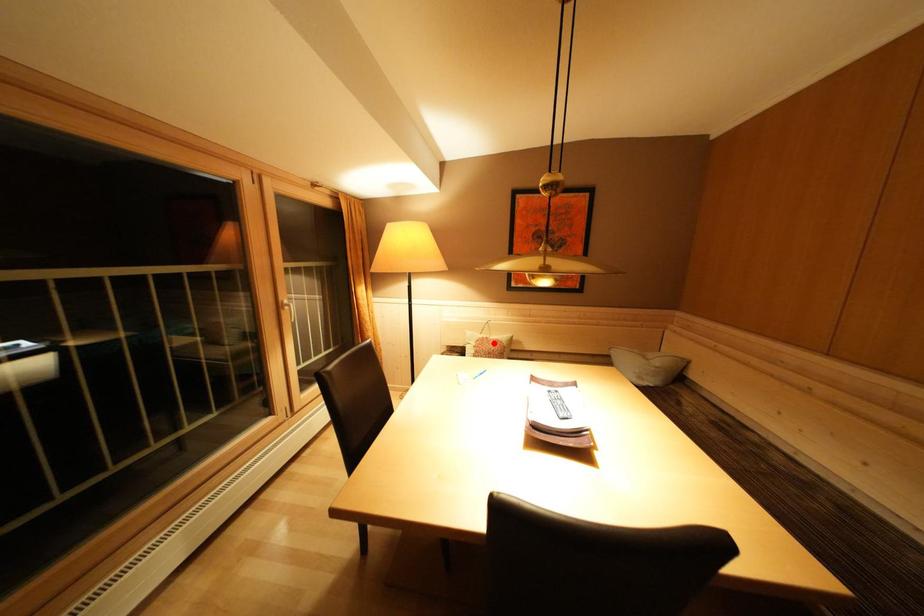
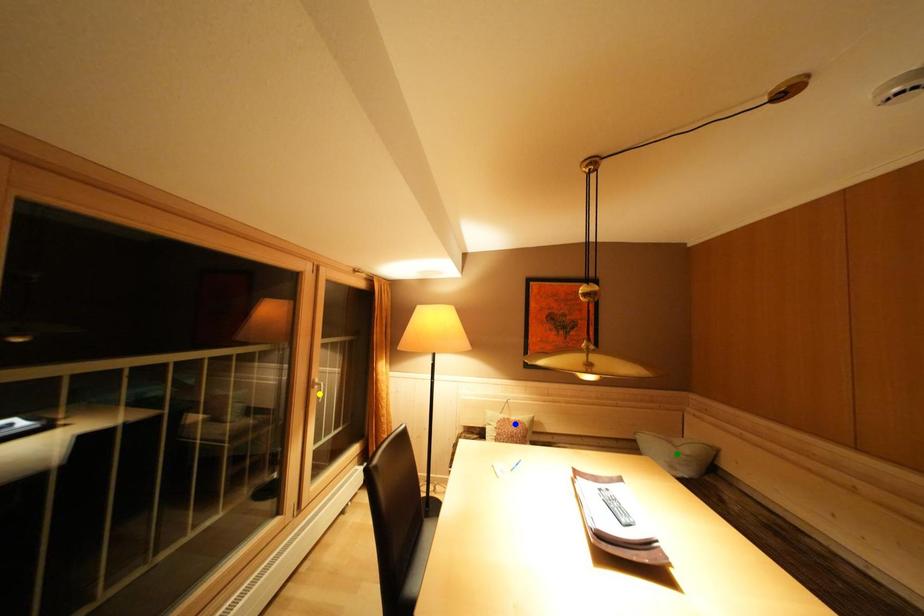
Question: I am providing you with two images of the same scene from different viewpoints. A red point is marked on the first image. You are given multiple points on the second image. Can you choose the point in image 2 that corresponds to the point in image 1?

Choices:
 (A) green point
 (B) blue point
 (C) yellow point

Answer: (B)